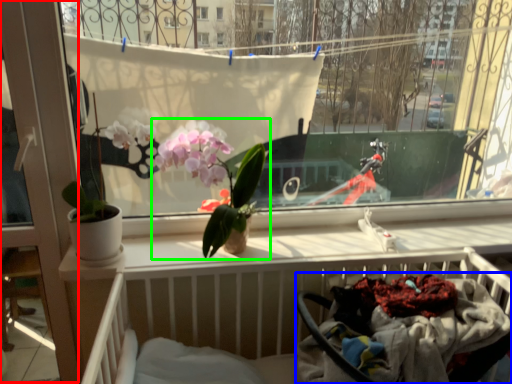
Question: Which object is positioned farthest from screen door (highlighted by a red box)? Select from baby carriage (highlighted by a blue box) and houseplant (highlighted by a green box).

Choices:
 (A) baby carriage
 (B) houseplant

Answer: (A)